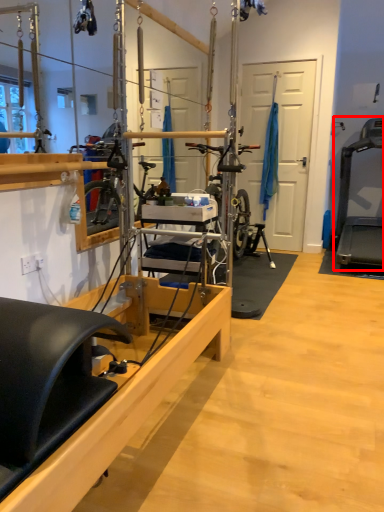
Question: From the image's perspective, what is the correct spatial relationship of treadmill (annotated by the red box) in relation to furniture?

Choices:
 (A) below
 (B) above

Answer: (B)